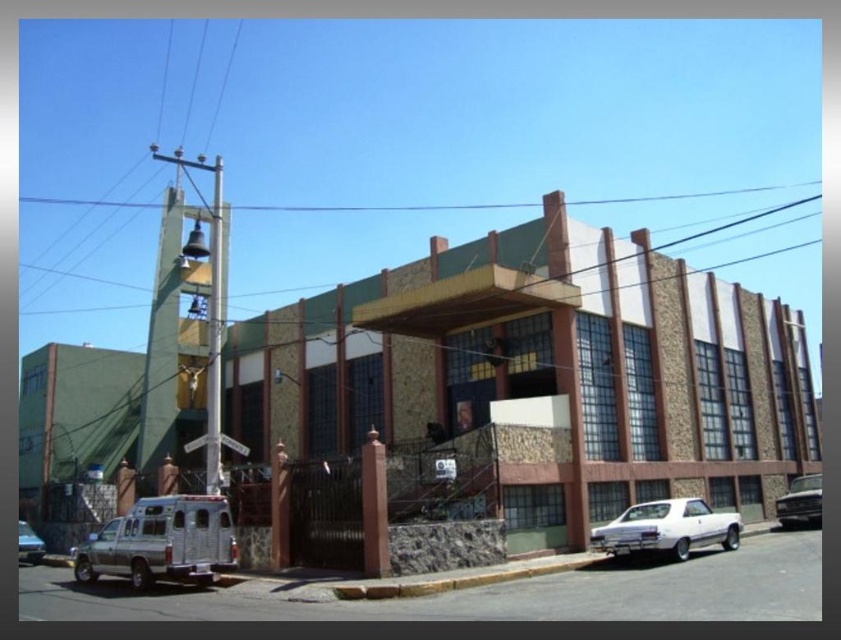
You are a delivery driver arriving at the building. You need to park your vehicle between the white matte sedan at lower right and the silver metallic van at lower left. Based on their positions, which vehicle should you park closer to in order to maintain a straight line with the building?

The white matte sedan at lower right is located above the silver metallic van at lower left, so to maintain a straight line with the building, you should park closer to the silver metallic van at lower left.

You are a delivery person trying to park your vehicle in the parking lot behind the building. The parking spaces are 2.5 meters wide. You have a metallic silver truck at lower right and a silver metallic van at lower left. Which vehicle would you choose to park in these spaces?

The silver metallic van at lower left is smaller in size compared to the metallic silver truck at lower right. Therefore, the silver metallic van at lower left would fit better in the 2.5 meter wide parking spaces.

You are a delivery driver who needs to park your vehicle in the parking lot behind the building. You have a metallic silver truck at lower right and a silver metallic van at lower left. Which vehicle should you move first to access the parking lot without blocking the other?

You should move the metallic silver truck at lower right first because it is closer to you than the silver metallic van at lower left, so moving it first will prevent blocking access to the van.